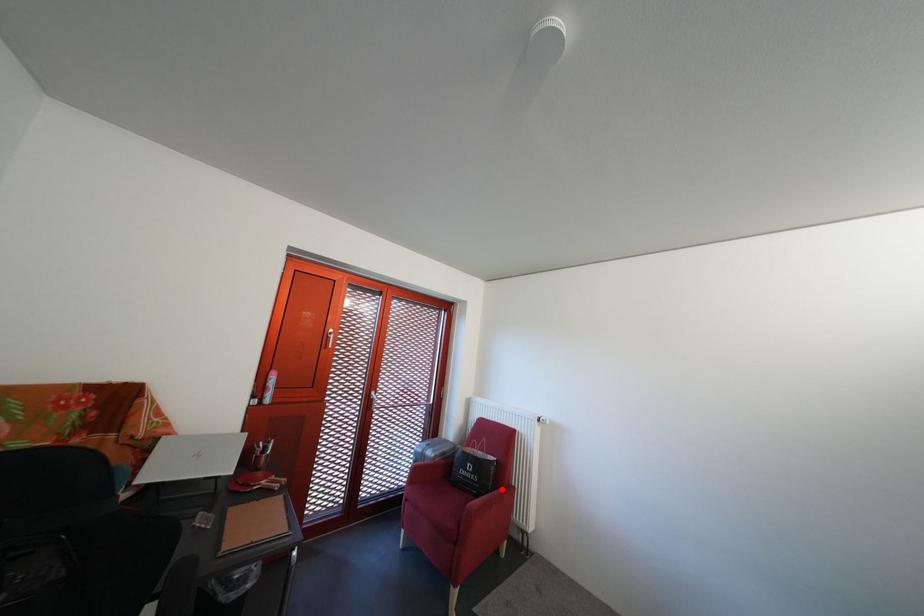
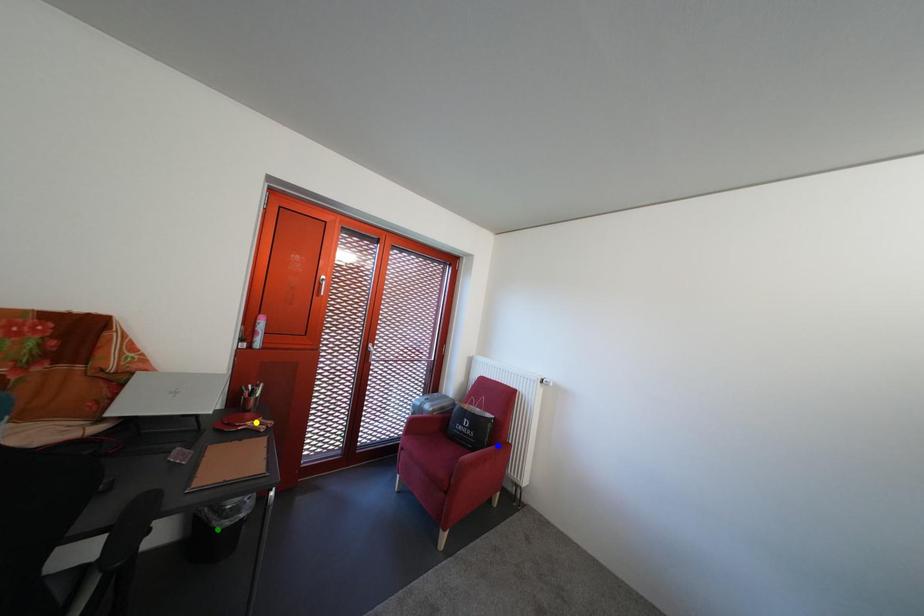
Question: I am providing you with two images of the same scene from different viewpoints. A red point is marked on the first image. You are given multiple points on the second image. Can you choose the point in image 2 that corresponds to the point in image 1?

Choices:
 (A) green point
 (B) yellow point
 (C) blue point

Answer: (C)